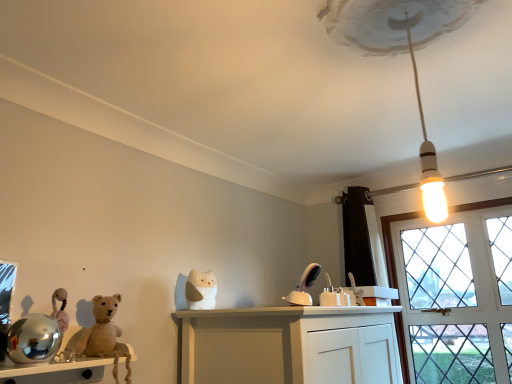
Question: Is there a large distance between fuzzy beige teddy bear at left and white glossy bulb at upper center?

Choices:
 (A) yes
 (B) no

Answer: (A)

Question: Is white glossy bulb at upper center at the back of fuzzy beige teddy bear at left?

Choices:
 (A) yes
 (B) no

Answer: (B)

Question: Does fuzzy beige teddy bear at left appear on the right side of white glossy bulb at upper center?

Choices:
 (A) yes
 (B) no

Answer: (B)

Question: From a real-world perspective, is fuzzy beige teddy bear at left positioned over white glossy bulb at upper center based on gravity?

Choices:
 (A) no
 (B) yes

Answer: (A)

Question: Considering the relative positions of fuzzy beige teddy bear at left and white glossy bulb at upper center in the image provided, is fuzzy beige teddy bear at left behind white glossy bulb at upper center?

Choices:
 (A) no
 (B) yes

Answer: (B)

Question: From the image's perspective, relative to clear glass window at right, is wooden shelf at lower left above or below?

Choices:
 (A) above
 (B) below

Answer: (A)

Question: Relative to clear glass window at right, is wooden shelf at lower left in front or behind?

Choices:
 (A) front
 (B) behind

Answer: (A)

Question: Based on their sizes in the image, would you say wooden shelf at lower left is bigger or smaller than clear glass window at right?

Choices:
 (A) small
 (B) big

Answer: (A)

Question: In terms of width, does wooden shelf at lower left look wider or thinner when compared to clear glass window at right?

Choices:
 (A) wide
 (B) thin

Answer: (B)

Question: From the image's perspective, is white glossy bulb at upper center above or below wooden shelf at lower left?

Choices:
 (A) above
 (B) below

Answer: (A)

Question: From a real-world perspective, is white glossy bulb at upper center positioned above or below wooden shelf at lower left?

Choices:
 (A) below
 (B) above

Answer: (B)

Question: Would you say white glossy bulb at upper center is inside or outside wooden shelf at lower left?

Choices:
 (A) outside
 (B) inside

Answer: (A)

Question: Based on their sizes in the image, would you say white glossy bulb at upper center is bigger or smaller than wooden shelf at lower left?

Choices:
 (A) big
 (B) small

Answer: (A)

Question: Is clear glass window at right wider or thinner than white matte cat at center?

Choices:
 (A) wide
 (B) thin

Answer: (A)

Question: From a real-world perspective, is clear glass window at right above or below white matte cat at center?

Choices:
 (A) below
 (B) above

Answer: (A)